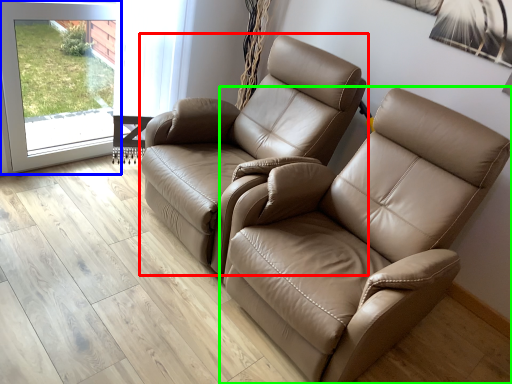
Question: Estimate the real-world distances between objects in this image. Which object is closer to chair (highlighted by a red box), screen door (highlighted by a blue box) or chair (highlighted by a green box)?

Choices:
 (A) screen door
 (B) chair

Answer: (B)